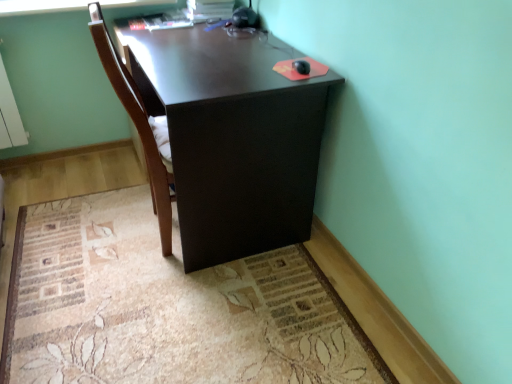
You are a GUI agent. You are given a task and a screenshot of the screen. Output one action in this format:
    pyautogui.click(x=<x>, y=<y>)
    Task: Click on the dark wood desk at center
    Image resolution: width=512 pixels, height=384 pixels.
    Given the screenshot: What is the action you would take?
    pyautogui.click(x=232, y=137)

What is the approximate width of beige carpet at lower center?

4.46 feet.

Identify the location of dark wood desk at center. This screenshot has width=512, height=384. (232, 137).

From the picture: Considering the sizes of objects brown wood chair at center and beige carpet at lower center in the image provided, who is bigger, brown wood chair at center or beige carpet at lower center?

brown wood chair at center.

Which object is positioned more to the right, brown wood chair at center or beige carpet at lower center?

Positioned to the right is beige carpet at lower center.

From the picture: Is brown wood chair at center turned away from beige carpet at lower center?

No, brown wood chair at center is not facing away from beige carpet at lower center.

Does brown wood chair at center have a greater width compared to beige carpet at lower center?

No.

You are a GUI agent. You are given a task and a screenshot of the screen. Output one action in this format:
    pyautogui.click(x=<x>, y=<y>)
    Task: Click on the chair on the left of dark wood desk at center
    The width and height of the screenshot is (512, 384).
    Given the screenshot: What is the action you would take?
    pyautogui.click(x=139, y=126)

Does brown wood chair at center have a greater width compared to dark wood desk at center?

Incorrect, the width of brown wood chair at center does not surpass that of dark wood desk at center.

Is brown wood chair at center with dark wood desk at center?

No, brown wood chair at center is not making contact with dark wood desk at center.

Is brown wood chair at center closer to camera compared to dark wood desk at center?

Yes, the depth of brown wood chair at center is less than that of dark wood desk at center.

Looking at their sizes, would you say dark wood desk at center is wider or thinner than beige carpet at lower center?

In the image, dark wood desk at center appears to be more narrow than beige carpet at lower center.

Is beige carpet at lower center located within dark wood desk at center?

That's incorrect, beige carpet at lower center is not inside dark wood desk at center.

Can you tell me how much dark wood desk at center and beige carpet at lower center differ in facing direction?

0.479 degrees.

Is dark wood desk at center bigger or smaller than beige carpet at lower center?

In the image, dark wood desk at center appears to be larger than beige carpet at lower center.

Between beige carpet at lower center and brown wood chair at center, which one has larger width?

Wider between the two is beige carpet at lower center.

Which is in front, point (23, 225) or point (117, 78)?

The point (117, 78) is more forward.

Is beige carpet at lower center smaller than brown wood chair at center?

Yes.

From a real-world perspective, is beige carpet at lower center over brown wood chair at center?

No, from a real-world perspective, beige carpet at lower center is not over brown wood chair at center

Which is more distant, (265,150) or (101,40)?

The point (265,150) is farther from the camera.

Is dark wood desk at center positioned with its back to brown wood chair at center?

dark wood desk at center is not turned away from brown wood chair at center.

Is dark wood desk at center bigger or smaller than brown wood chair at center?

In the image, dark wood desk at center appears to be larger than brown wood chair at center.

From the picture: Is beige carpet at lower center aimed at dark wood desk at center?

No.

From a real-world perspective, relative to dark wood desk at center, is beige carpet at lower center vertically above or below?

beige carpet at lower center is below dark wood desk at center.

From the image's perspective, which one is positioned lower, beige carpet at lower center or dark wood desk at center?

beige carpet at lower center is shown below in the image.

Find the location of a particular element. Image resolution: width=512 pixels, height=384 pixels. mat below the brown wood chair at center (from the image's perspective) is located at coordinates (167, 307).

The width and height of the screenshot is (512, 384). In order to click on desk behind the brown wood chair at center in this screenshot , I will do `click(232, 137)`.

Based on their spatial positions, is brown wood chair at center or beige carpet at lower center closer to dark wood desk at center?

Among the two, brown wood chair at center is located nearer to dark wood desk at center.

Considering their positions, is dark wood desk at center positioned closer to beige carpet at lower center than brown wood chair at center?

The object closer to beige carpet at lower center is dark wood desk at center.

Based on their spatial positions, is beige carpet at lower center or brown wood chair at center further from dark wood desk at center?

Among the two, beige carpet at lower center is located further to dark wood desk at center.

Looking at the image, which one is located closer to beige carpet at lower center, brown wood chair at center or dark wood desk at center?

The object closer to beige carpet at lower center is dark wood desk at center.

Considering their positions, is beige carpet at lower center positioned further to brown wood chair at center than dark wood desk at center?

beige carpet at lower center lies further to brown wood chair at center than the other object.

When comparing their distances from brown wood chair at center, does dark wood desk at center or beige carpet at lower center seem closer?

dark wood desk at center is positioned closer to the anchor brown wood chair at center.

Identify the location of chair between dark wood desk at center and beige carpet at lower center in the vertical direction. (139, 126).